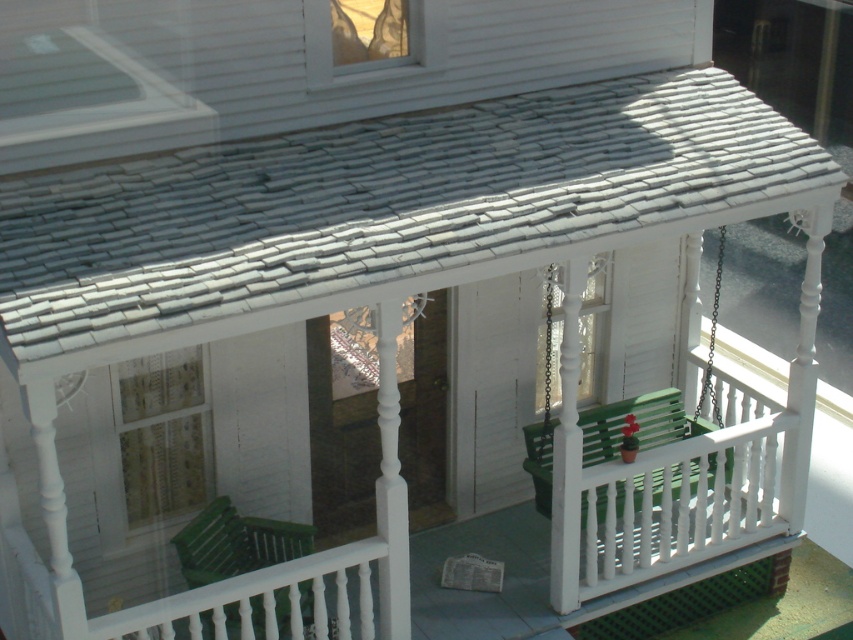
You are moving a 7.5 feet long ladder from the garage to the garden. You need to carry it through the front porch where the white wooden balustrade at center and green plastic rocking chair at lower left are located. Will the ladder fit through the space between them?

The distance between the white wooden balustrade at center and green plastic rocking chair at lower left is 8.12 feet. Since the ladder is 7.5 feet long, it will fit through the space as there is enough clearance.

You are planning to place a 3 feet wide decorative item on the porch. Which object between the green wooden bench at center and the green plastic rocking chair at lower left would be more suitable to place it on, considering their widths?

The green wooden bench at center has a greater width than the green plastic rocking chair at lower left, so placing the 3 feet wide decorative item on the green wooden bench at center would be more suitable.

You are standing on the front porch of the white house and want to sit down on the green wooden bench at center. If you are currently at the point with coordinates point (650,410), can you reach the green wooden bench at center?

The point (650,410) corresponds to the green wooden bench at center, so you are already at the green wooden bench at center.